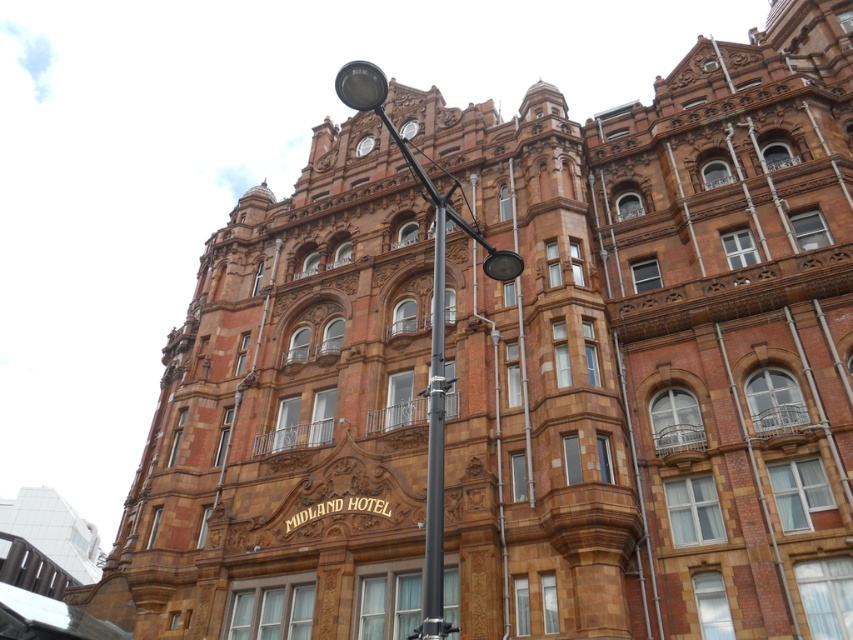
What is the spatial relationship between the black metal lamp post at center and the metallic gray pole at center in the Midland Hotel scene?

The black metal lamp post at center is located to the left of the metallic gray pole at center.

You are standing in front of the Midland Hotel and need to determine which object is bigger between the black metal lamp post at center and the metallic gray pole at center. Can you identify the larger one?

The black metal lamp post at center has a larger size compared to the metallic gray pole at center, so the black metal lamp post at center is bigger.

You are standing in front of the Midland Hotel and see two points marked on its facade. The first point is at coordinates point (434, 284) and the second is at point (444, 243). From your perspective, which point is closer to you?

Point (444, 243) is closer to you because it is in front of point (434, 284).